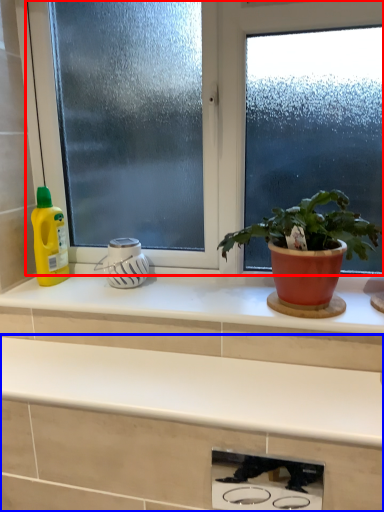
Question: Which of the following is the closest to the observer, window (highlighted by a red box) or countertop (highlighted by a blue box)?

Choices:
 (A) window
 (B) countertop

Answer: (B)